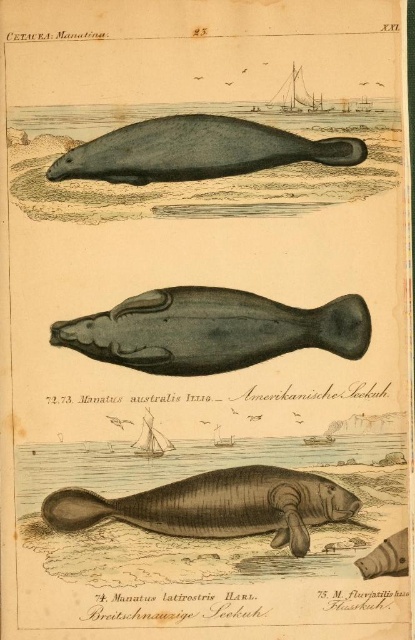
Based on the illustration labeled CETACEA Manatina on page 25, which manatee species depicted in the top section has a taller body between the gray matte seal at upper center and the smooth gray seal at lower right?

The gray matte seal at upper center is taller than the smooth gray seal at lower right.

Based on the illustration labeled CETACEA Manatina, you are a marine biologist examining the top section. You see a dark gray matte whale at center and a brown textured seal at center. Which animal is layered on top of the other?

The dark gray matte whale at center is positioned over the brown textured seal at center.

Based on the illustration labeled CETACEA Manatina on page 25, where is the dark gray matte whale at center located in the top section?

The dark gray matte whale at center is located at point (x=212, y=330) in the top section.